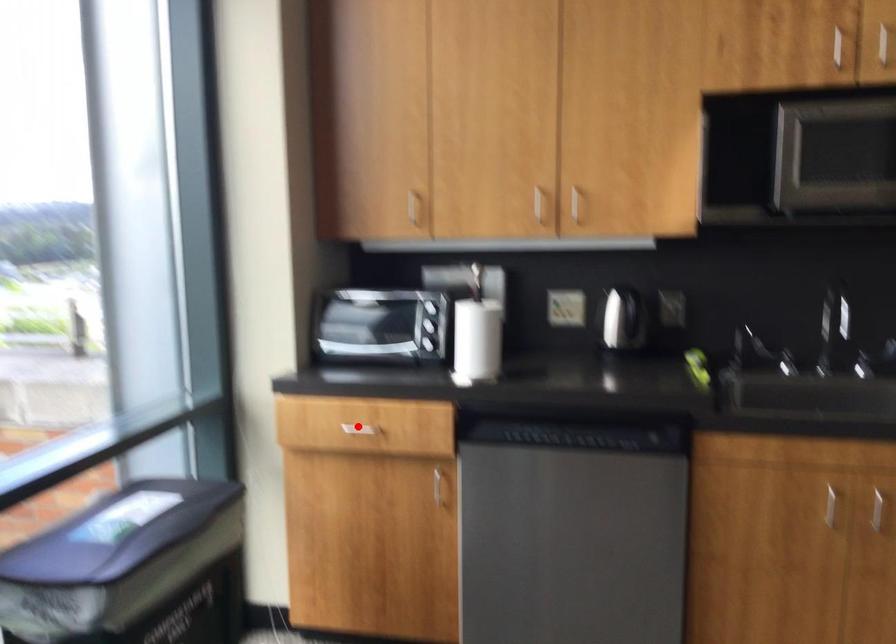
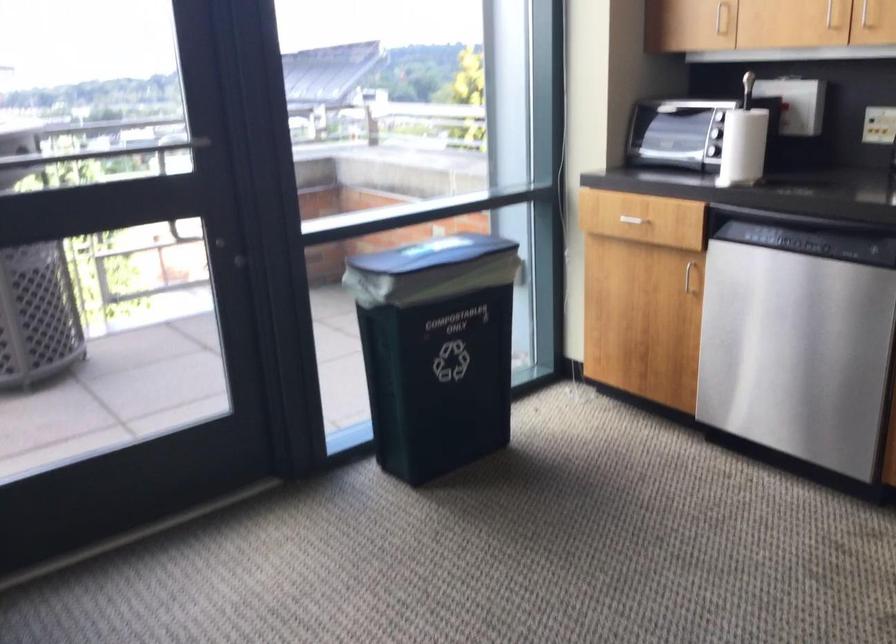
The point at the highlighted location is marked in the first image. Where is the corresponding point in the second image?

(633, 214)